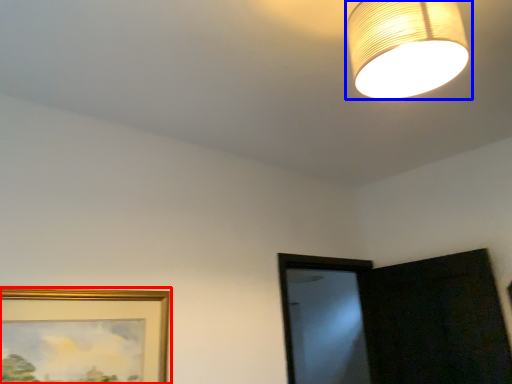
Question: Among these objects, which one is nearest to the camera, picture frame (highlighted by a red box) or lamp (highlighted by a blue box)?

Choices:
 (A) picture frame
 (B) lamp

Answer: (B)